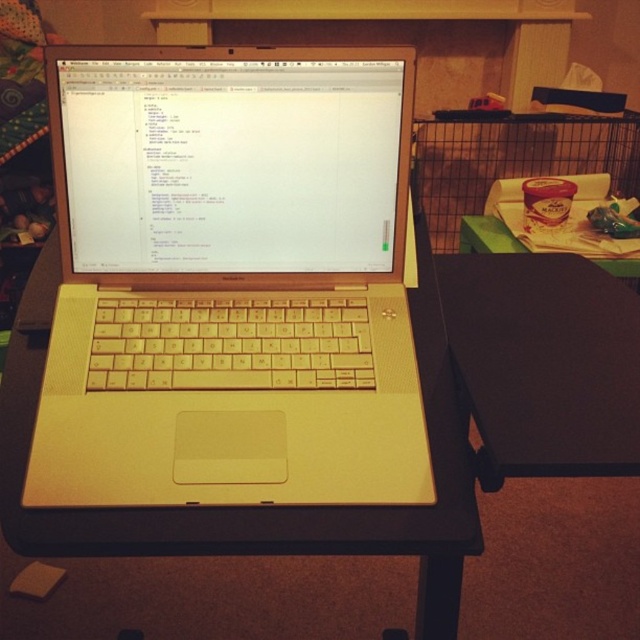
Question: Which of the following is the closest to the observer?

Choices:
 (A) (584, 364)
 (B) (497, 132)
 (C) (492, 230)
 (D) (237, 228)

Answer: (A)

Question: Is the position of black matte table at center more distant than that of metal wire cage at right?

Choices:
 (A) no
 (B) yes

Answer: (A)

Question: Which point is farther to the camera?

Choices:
 (A) (445, 314)
 (B) (428, 161)
 (C) (184, 224)
 (D) (474, 236)

Answer: (B)

Question: Is black matte table at center positioned at the back of metal wire cage at right?

Choices:
 (A) yes
 (B) no

Answer: (B)

Question: Does metal wire cage at right appear under green matte table at right?

Choices:
 (A) no
 (B) yes

Answer: (A)

Question: Which point appears farthest from the camera in this image?

Choices:
 (A) (525, 385)
 (B) (621, 157)
 (C) (228, 182)
 (D) (483, 218)

Answer: (B)